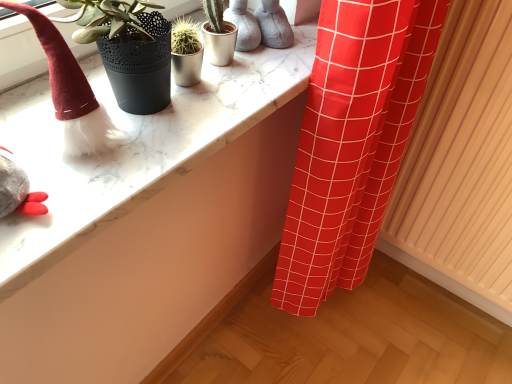
You are a GUI agent. You are given a task and a screenshot of the screen. Output one action in this format:
    pyautogui.click(x=<x>, y=<y>)
    Task: Click on the empty space that is to the right of fuzzy red hat at left
    The width and height of the screenshot is (512, 384).
    Given the screenshot: What is the action you would take?
    pyautogui.click(x=170, y=127)